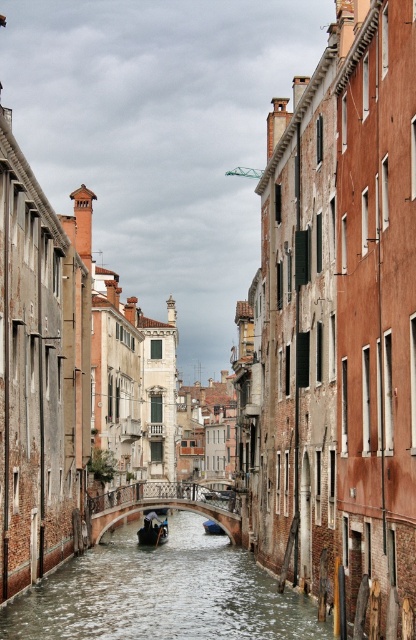
Question: Which point appears closest to the camera in this image?

Choices:
 (A) (138, 540)
 (B) (249, 563)
 (C) (212, 531)

Answer: (B)

Question: Is clear water at canal center in front of wooden polished boat at center?

Choices:
 (A) no
 (B) yes

Answer: (B)

Question: Which point appears farthest from the camera in this image?

Choices:
 (A) (220, 532)
 (B) (126, 612)
 (C) (150, 538)

Answer: (A)

Question: Does clear water at canal center have a smaller size compared to wooden polished boat at center?

Choices:
 (A) no
 (B) yes

Answer: (A)

Question: Which of the following is the closest to the observer?

Choices:
 (A) (141, 545)
 (B) (220, 532)
 (C) (138, 586)

Answer: (C)

Question: Is clear water at canal center closer to camera compared to wooden polished boat at center?

Choices:
 (A) no
 (B) yes

Answer: (B)